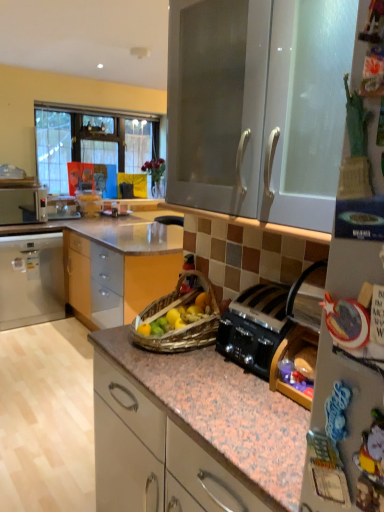
Question: Could you tell me if black metallic toaster at center-right is turned towards white plastic microwave at left?

Choices:
 (A) no
 (B) yes

Answer: (A)

Question: Considering the relative positions of black metallic toaster at center-right and white plastic microwave at left in the image provided, is black metallic toaster at center-right to the right of white plastic microwave at left from the viewer's perspective?

Choices:
 (A) no
 (B) yes

Answer: (B)

Question: Is black metallic toaster at center-right far from white plastic microwave at left?

Choices:
 (A) no
 (B) yes

Answer: (B)

Question: Is black metallic toaster at center-right taller than white plastic microwave at left?

Choices:
 (A) no
 (B) yes

Answer: (A)

Question: Would you say white plastic microwave at left is part of black metallic toaster at center-right's contents?

Choices:
 (A) yes
 (B) no

Answer: (B)

Question: Considering the relative sizes of black metallic toaster at center-right and white plastic microwave at left in the image provided, is black metallic toaster at center-right wider than white plastic microwave at left?

Choices:
 (A) yes
 (B) no

Answer: (B)

Question: Is white glossy cabinet at upper center, which is the 2th cabinetry from left to right, shorter than white plastic microwave at left?

Choices:
 (A) no
 (B) yes

Answer: (A)

Question: Considering the relative positions of white glossy cabinet at upper center, which is the 2th cabinetry from left to right, and white plastic microwave at left in the image provided, is white glossy cabinet at upper center, which is the 2th cabinetry from left to right, to the left of white plastic microwave at left from the viewer's perspective?

Choices:
 (A) yes
 (B) no

Answer: (B)

Question: Is white glossy cabinet at upper center, positioned as the 2th cabinetry in back-to-front order, thinner than white plastic microwave at left?

Choices:
 (A) no
 (B) yes

Answer: (B)

Question: Does white glossy cabinet at upper center, which is the 2th cabinetry from left to right, have a larger size compared to white plastic microwave at left?

Choices:
 (A) no
 (B) yes

Answer: (B)

Question: Is white glossy cabinet at upper center, the first cabinetry in the right-to-left sequence, completely or partially outside of white plastic microwave at left?

Choices:
 (A) yes
 (B) no

Answer: (A)

Question: Is there a large distance between white glossy cabinet at upper center, positioned as the 2th cabinetry in back-to-front order, and white plastic microwave at left?

Choices:
 (A) yes
 (B) no

Answer: (A)

Question: Does white plastic microwave at left have a lesser width compared to black metallic toaster at center-right?

Choices:
 (A) no
 (B) yes

Answer: (A)